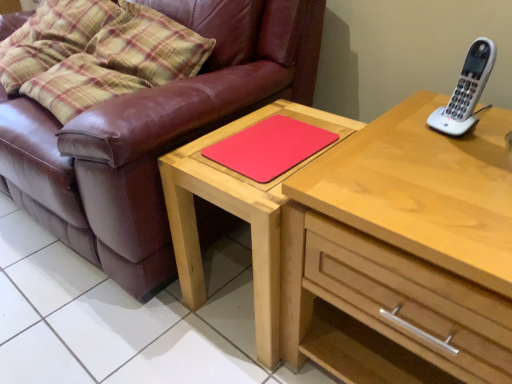
The width and height of the screenshot is (512, 384). In order to click on free space above rubberized red mousepad at center (from a real-world perspective) in this screenshot , I will do `click(274, 136)`.